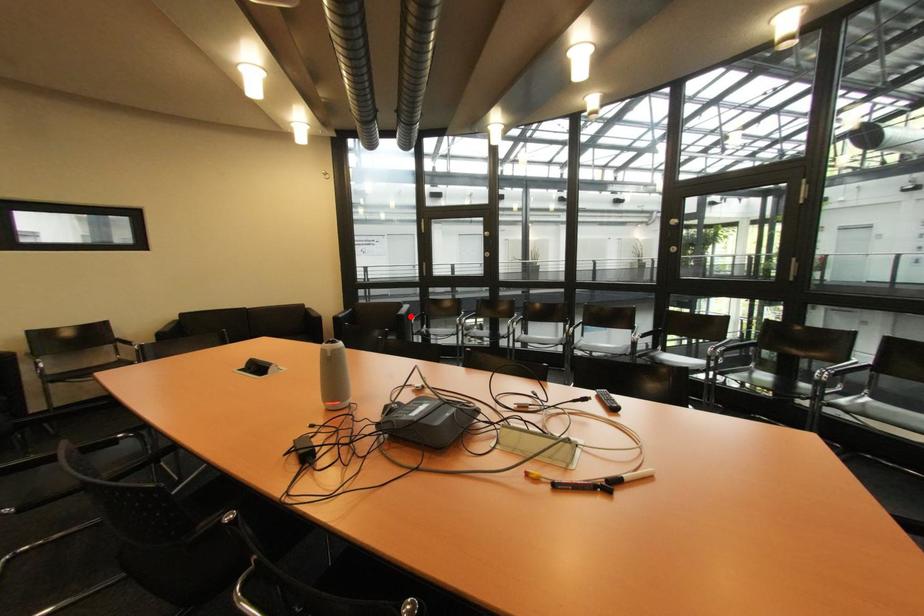
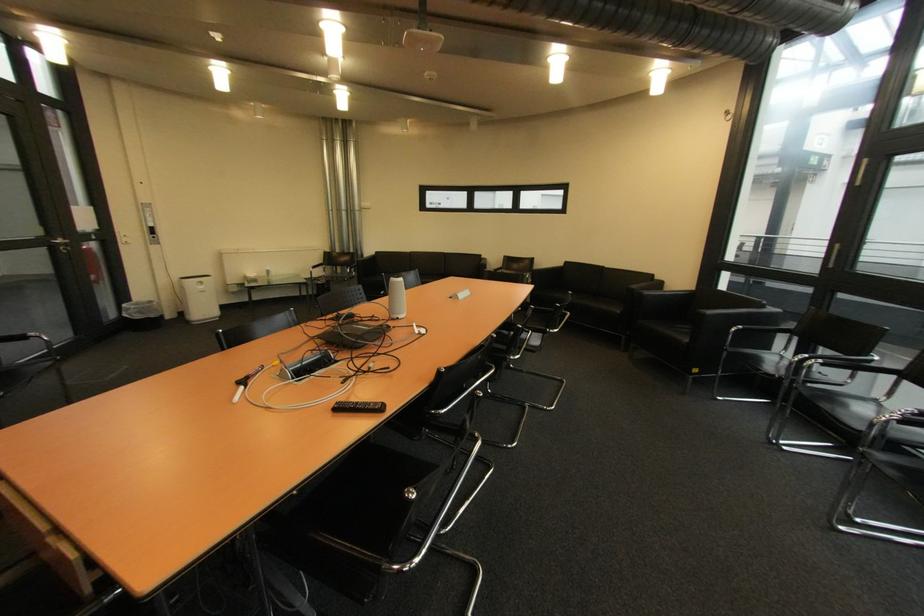
Question: I am providing you with two images of the same scene from different viewpoints. Given a red point in image1, look at the same physical point in image2. Is it:

Choices:
 (A) Closer to the viewpoint
 (B) Farther from the viewpoint

Answer: (B)